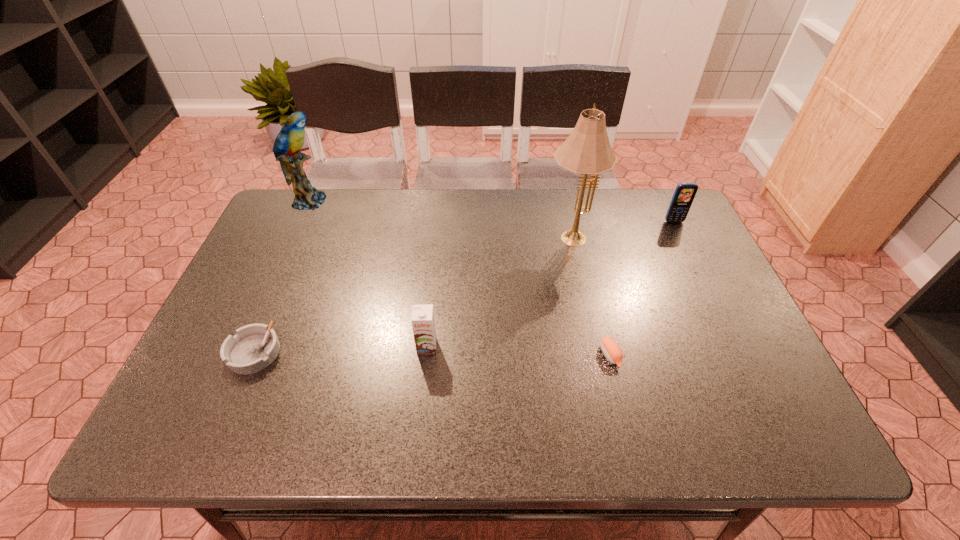
Where is `vacant space positioned 0.270m on the left of the third object from left to right`? The height and width of the screenshot is (540, 960). vacant space positioned 0.270m on the left of the third object from left to right is located at coordinates (303, 347).

Find the location of a particular element. blank space located on the right of the ashtray is located at coordinates (366, 352).

What are the coordinates of `free space located on the left of the sushi` in the screenshot? It's located at (493, 355).

At what (x,y) coordinates should I click in order to perform the action: click on lampshade present at the far edge. Please return your answer as a coordinate pair (x, y). The image size is (960, 540). Looking at the image, I should click on (587, 150).

The height and width of the screenshot is (540, 960). What are the coordinates of `parrot at the far edge` in the screenshot? It's located at (289, 141).

The width and height of the screenshot is (960, 540). Identify the location of cellular telephone located in the far edge section of the desktop. (684, 194).

Where is `parrot positioned at the left edge`? The image size is (960, 540). parrot positioned at the left edge is located at coordinates (289, 141).

Locate an element on the screen. The width and height of the screenshot is (960, 540). ashtray that is at the left edge is located at coordinates 255,346.

Find the location of `object at the right edge`. object at the right edge is located at coordinates (684, 194).

Find the location of a particular element. object that is at the far left corner is located at coordinates (289, 141).